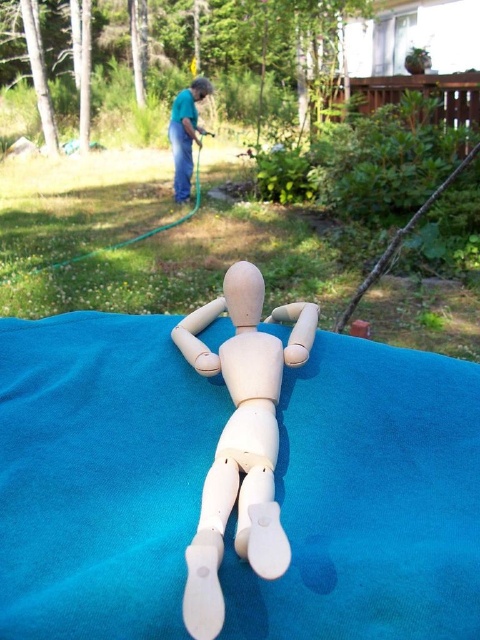
You are standing at the point with coordinates [240,440] in the image. What object is located exactly at your current position?

The wooden mannequin at center is located exactly at the point with coordinates [240,440].

You are a photographer setting up a shoot in this outdoor scene. You need to place a prop on the white matte tablecloth at center so that it is visible from above. Is the blue fabric doll at upper center blocking the view of the tablecloth?

The white matte tablecloth at center is below the blue fabric doll at upper center, so the doll is blocking the view of the tablecloth from above.

You are setting up a picnic in the garden and have a white matte tablecloth at center and a wooden mannequin at center. To ensure the mannequin is stable, where should you place it?

The wooden mannequin at center should be placed on top of the white matte tablecloth at center since the tablecloth is positioned under it.